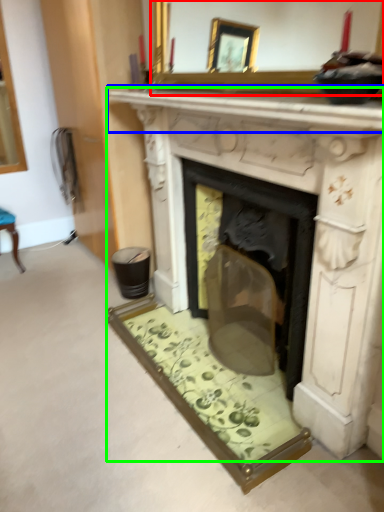
Question: Which object is positioned farthest from mirror (highlighted by a red box)? Select from mantle (highlighted by a blue box) and fireplace (highlighted by a green box).

Choices:
 (A) mantle
 (B) fireplace

Answer: (B)